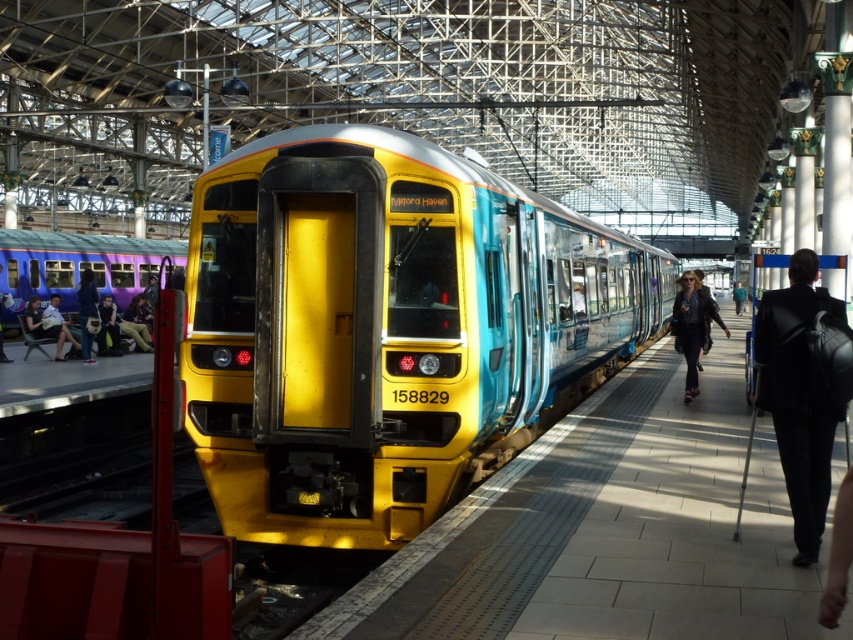
You are a photographer standing on the platform at the train station. You want to take a photo that includes both the dark suit at right and the leather jacket at center. Which person should you focus on first to ensure they are in the frame?

The dark suit at right is not as tall as the leather jacket at center, so you should focus on the leather jacket at center first to ensure both are in the frame.

From the picture: You are standing on the train platform and want to walk towards the train. There are two points marked on the platform, point (549, 280) and point (49, 333). Which point should you head towards to get closer to the train?

Point (549, 280) is closer to the viewer than point (49, 333), so you should head towards point (549, 280) to get closer to the train.

You are a photographer standing on the platform at the train station. You want to take a photo of the matte purple train at left and the matte black jacket at left. Since you want both objects to be clearly visible in the frame, which object should you zoom in on to ensure both are in focus?

The matte purple train at left is wider than the matte black jacket at left, so you should zoom in on the smaller object, the matte black jacket at left, to ensure both are in focus.